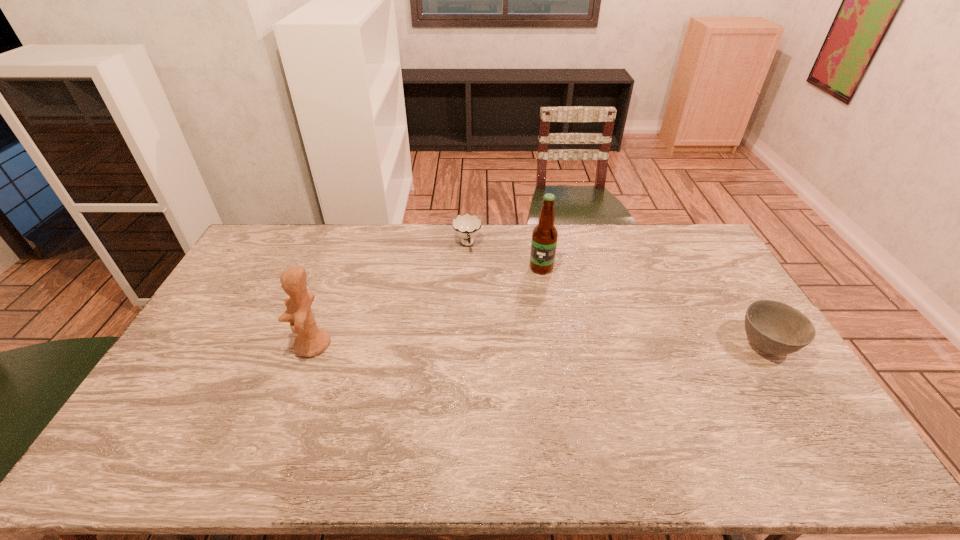
You are a GUI agent. You are given a task and a screenshot of the screen. Output one action in this format:
    pyautogui.click(x=<x>, y=<y>)
    Task: Click on the vacant space situated 0.160m on the side of the farthest object with the handle
    The width and height of the screenshot is (960, 540).
    Given the screenshot: What is the action you would take?
    pyautogui.click(x=474, y=284)

The width and height of the screenshot is (960, 540). What are the coordinates of `vacant position located on the side of the farthest object with the handle` in the screenshot? It's located at (476, 293).

You are a GUI agent. You are given a task and a screenshot of the screen. Output one action in this format:
    pyautogui.click(x=<x>, y=<y>)
    Task: Click on the vacant space located 0.150m on the side of the farthest object with the handle
    The height and width of the screenshot is (540, 960).
    Given the screenshot: What is the action you would take?
    click(474, 282)

At what (x,y) coordinates should I click in order to perform the action: click on free spot located on the label of the second object from right to left. Please return your answer as a coordinate pair (x, y). This screenshot has height=540, width=960. Looking at the image, I should click on (530, 285).

This screenshot has height=540, width=960. Identify the location of vacant space situated 0.050m on the label of the second object from right to left. (531, 283).

Where is `free location located 0.370m on the label of the second object from right to left`? free location located 0.370m on the label of the second object from right to left is located at coordinates (489, 345).

Where is `cup that is positioned at the far edge`? cup that is positioned at the far edge is located at coordinates (466, 226).

Find the location of `beer bottle that is at the far edge`. beer bottle that is at the far edge is located at coordinates (544, 236).

Image resolution: width=960 pixels, height=540 pixels. Find the location of `object present at the right edge`. object present at the right edge is located at coordinates (773, 327).

I want to click on vacant space at the far edge of the desktop, so click(x=516, y=225).